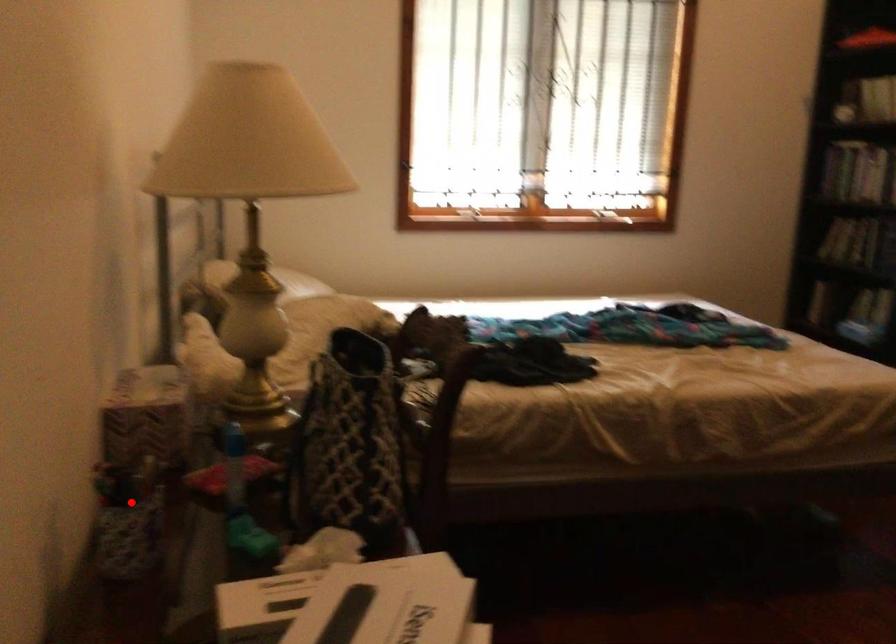
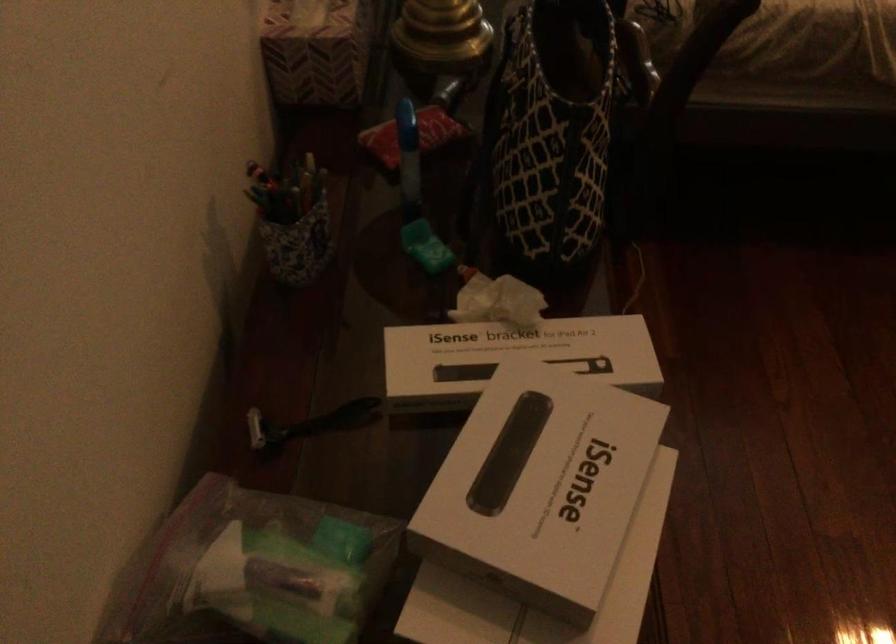
The point at the highlighted location is marked in the first image. Where is the corresponding point in the second image?

(291, 220)